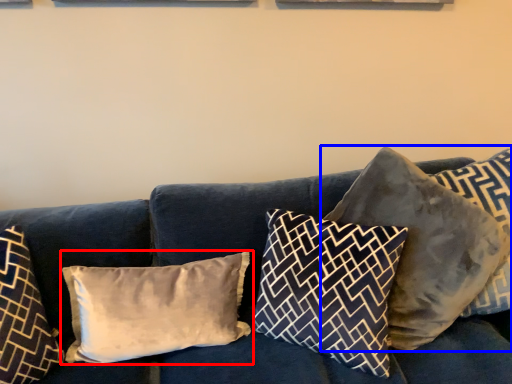
Question: Which object is closer to the camera taking this photo, pillow (highlighted by a red box) or pillow (highlighted by a blue box)?

Choices:
 (A) pillow
 (B) pillow

Answer: (B)